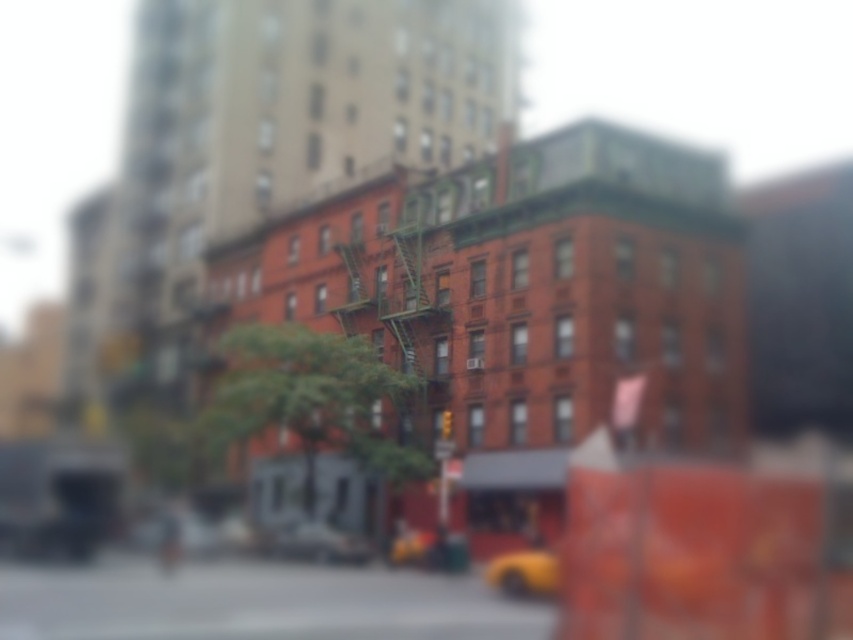
Question: Is yellow matte car at center further to camera compared to yellow rubber taxi at lower center?

Choices:
 (A) no
 (B) yes

Answer: (B)

Question: Is yellow matte car at center in front of yellow rubber taxi at lower center?

Choices:
 (A) no
 (B) yes

Answer: (A)

Question: Can you confirm if yellow matte car at center is bigger than yellow rubber taxi at lower center?

Choices:
 (A) yes
 (B) no

Answer: (B)

Question: Which object is closer to the camera taking this photo?

Choices:
 (A) yellow matte car at center
 (B) yellow rubber taxi at lower center

Answer: (B)

Question: Which object is farther from the camera taking this photo?

Choices:
 (A) yellow rubber taxi at lower center
 (B) yellow matte car at center

Answer: (B)

Question: Which point is farther to the camera?

Choices:
 (A) (503, 589)
 (B) (331, 536)

Answer: (B)